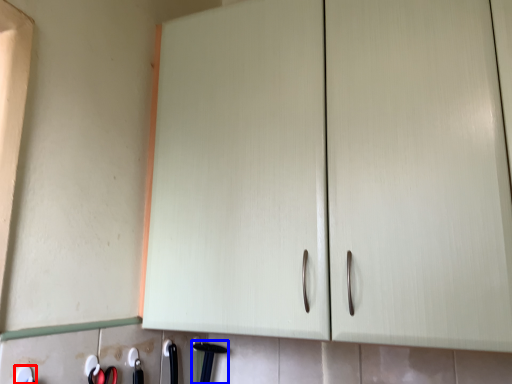
Question: Which point is further to the camera, tool (highlighted by a red box) or door handle (highlighted by a blue box)?

Choices:
 (A) tool
 (B) door handle

Answer: (B)